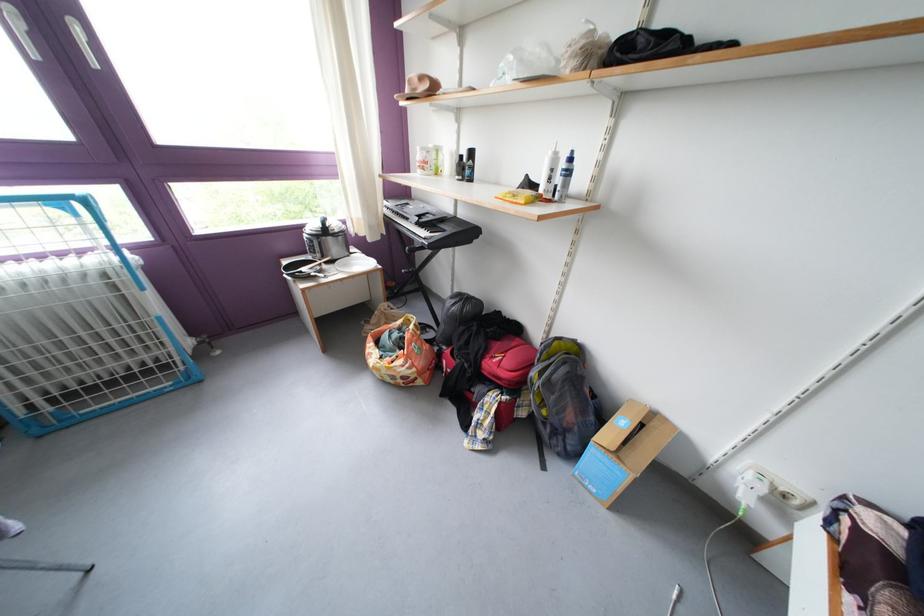
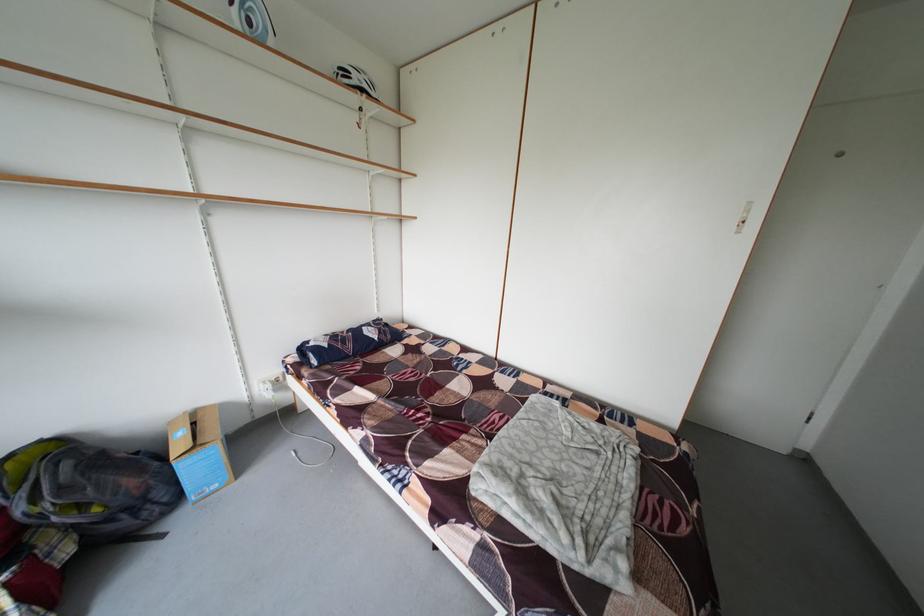
Locate, in the second image, the point that corresponds to pixel 758 467 in the first image.

(265, 387)